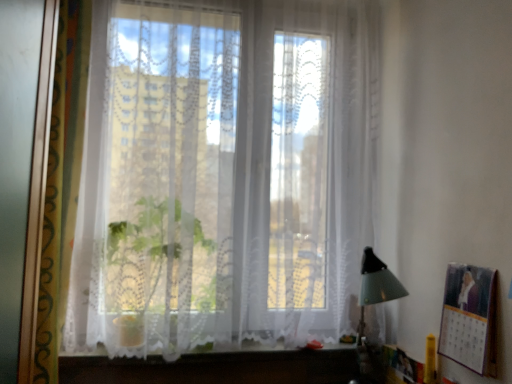
Question: Is metallic silver picture frame at right inside or outside of transparent lace curtain at center?

Choices:
 (A) inside
 (B) outside

Answer: (B)

Question: Looking at the image, does metallic silver picture frame at right seem bigger or smaller compared to transparent lace curtain at center?

Choices:
 (A) big
 (B) small

Answer: (B)

Question: Estimate the real-world distances between objects in this image. Which object is closer to the transparent lace curtain at center?

Choices:
 (A) white lace vanity at lower center
 (B) metallic silver picture frame at right

Answer: (A)

Question: Estimate the real-world distances between objects in this image. Which object is farther from the metallic silver picture frame at right?

Choices:
 (A) transparent lace curtain at center
 (B) white lace vanity at lower center

Answer: (A)